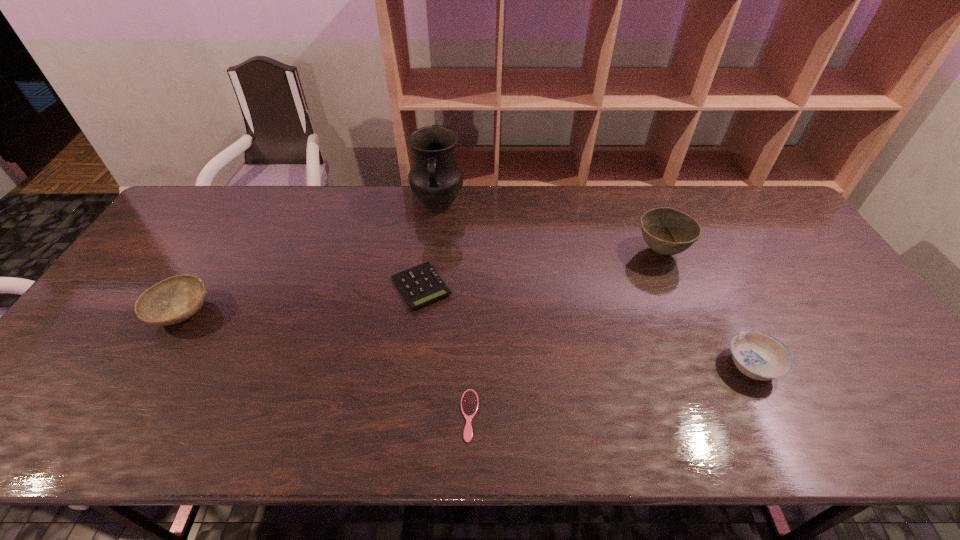
Find the location of a particular element. the fourth object from left to right is located at coordinates tap(469, 402).

What are the coordinates of `free space located on the handle side of the tallest object` in the screenshot? It's located at (427, 305).

At what (x,y) coordinates should I click in order to perform the action: click on vacant point located on the right of the tallest bowl. Please return your answer as a coordinate pair (x, y). The height and width of the screenshot is (540, 960). Looking at the image, I should click on (789, 252).

Find the location of `vacant space located 0.090m on the front of the leftmost bowl`. vacant space located 0.090m on the front of the leftmost bowl is located at coordinates (148, 368).

This screenshot has height=540, width=960. What are the coordinates of `free space located 0.150m on the left of the shortest bowl` in the screenshot? It's located at (661, 366).

The width and height of the screenshot is (960, 540). What are the coordinates of `free space located on the back of the second shortest object` in the screenshot? It's located at (428, 231).

The image size is (960, 540). I want to click on vacant area situated 0.070m on the right of the shortest object, so click(x=510, y=415).

Image resolution: width=960 pixels, height=540 pixels. Find the location of `object situated at the far edge`. object situated at the far edge is located at coordinates (435, 178).

At what (x,y) coordinates should I click in order to perform the action: click on object that is at the near edge. Please return your answer as a coordinate pair (x, y). The height and width of the screenshot is (540, 960). Looking at the image, I should click on (469, 402).

Find the location of a particular element. object that is positioned at the left edge is located at coordinates (173, 300).